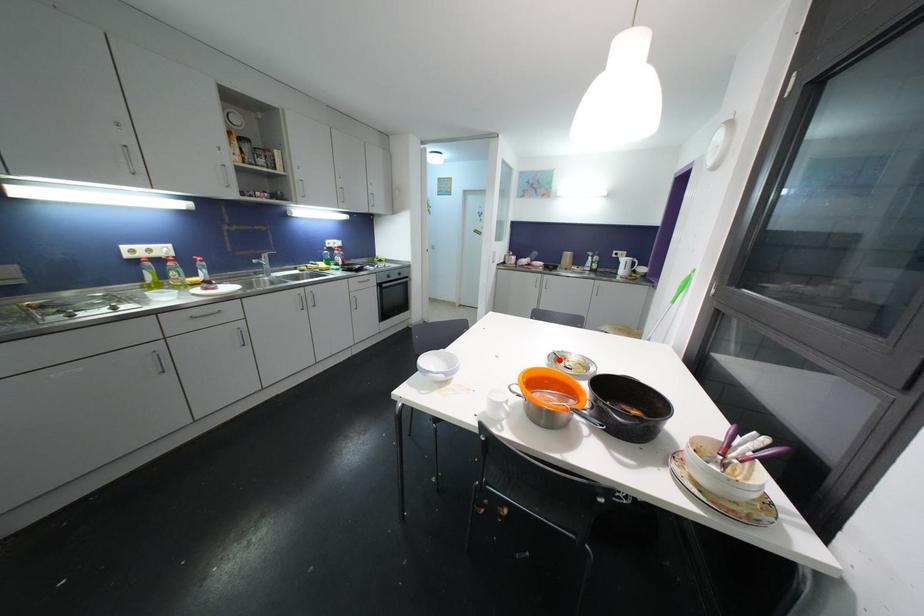
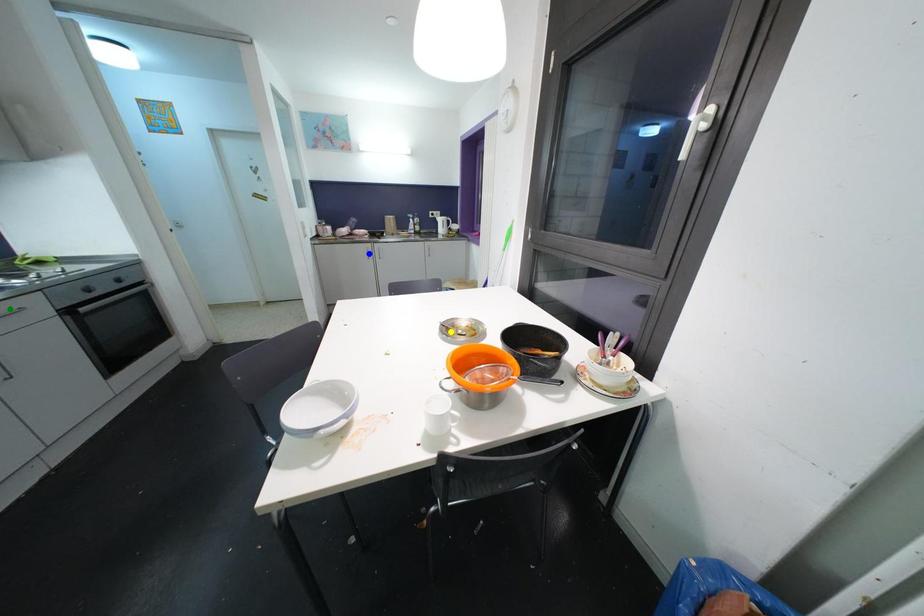
Question: I am providing you with two images of the same scene from different viewpoints. A red point is marked on the first image. You are given multiple points on the second image. Which point in image 2 is actually the same real-world point as the red point in image 1?

Choices:
 (A) green point
 (B) blue point
 (C) yellow point

Answer: (C)